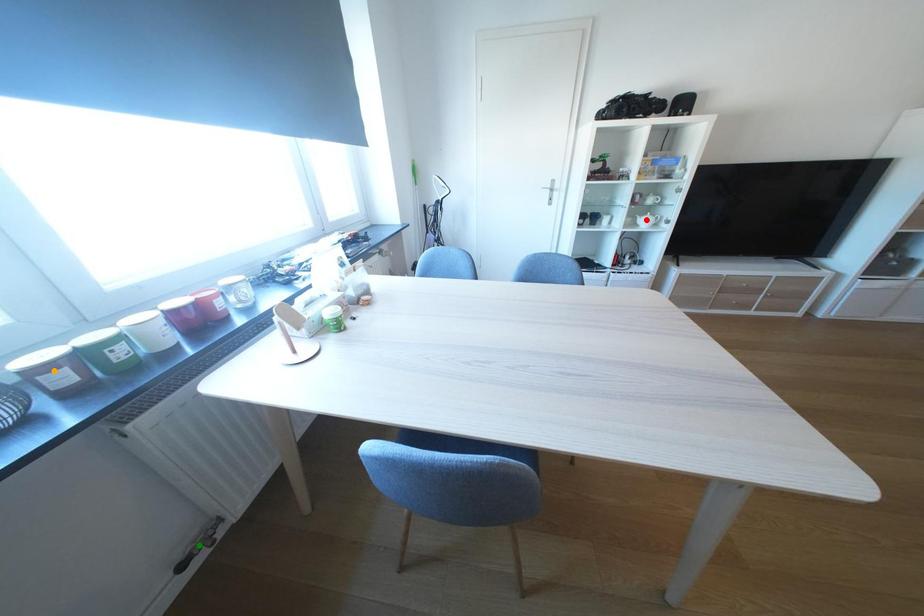
Order these from nearest to farthest:
green point
orange point
red point

orange point
green point
red point